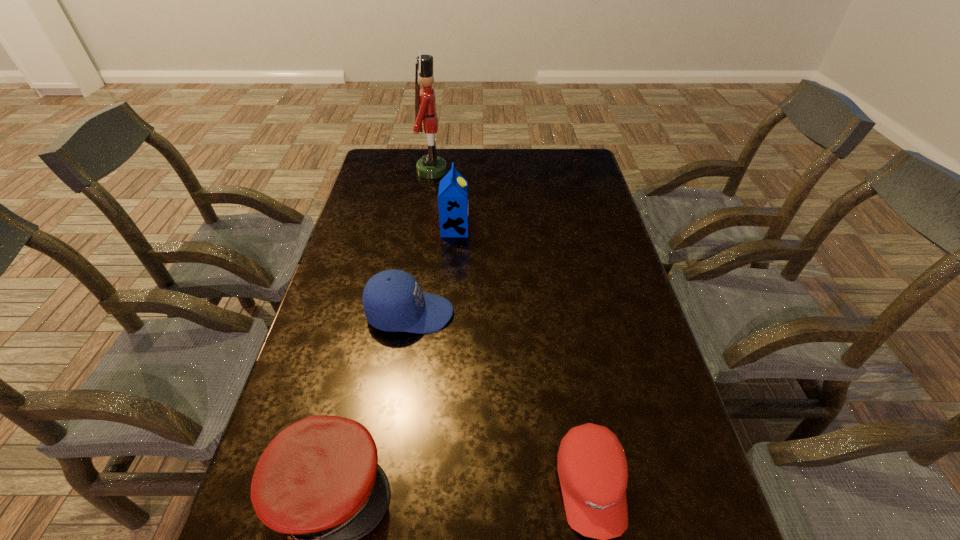
I want to click on object at the left edge, so click(x=393, y=301).

At what (x,y) coordinates should I click in order to perform the action: click on free location at the far edge of the desktop. Please return your answer as a coordinate pair (x, y). The height and width of the screenshot is (540, 960). Looking at the image, I should click on (512, 164).

I want to click on free location at the left edge of the desktop, so click(362, 189).

This screenshot has height=540, width=960. Identify the location of free location at the right edge of the desktop. (680, 434).

Locate an element on the screen. This screenshot has height=540, width=960. vacant space at the far right corner of the desktop is located at coordinates (575, 154).

Locate an element on the screen. This screenshot has height=540, width=960. vacant area that lies between the farthest object and the tallest cap is located at coordinates (421, 242).

Identify which object is located as the third nearest to the rightmost cap. Please provide its 2D coordinates. Your answer should be formatted as a tuple, i.e. [(x, y)], where the tuple contains the x and y coordinates of a point satisfying the conditions above.

[(453, 203)]

Locate an element on the screen. object that can be found as the third closest to the rightmost cap is located at coordinates click(453, 203).

Choose which cap is the third nearest neighbor to the second farthest object. Please provide its 2D coordinates. Your answer should be formatted as a tuple, i.e. [(x, y)], where the tuple contains the x and y coordinates of a point satisfying the conditions above.

[(593, 471)]

You are a GUI agent. You are given a task and a screenshot of the screen. Output one action in this format:
    pyautogui.click(x=<x>, y=<y>)
    Task: Click on the cap object that ranks as the closest to the nutcracker
    Image resolution: width=960 pixels, height=540 pixels.
    Given the screenshot: What is the action you would take?
    pyautogui.click(x=393, y=301)